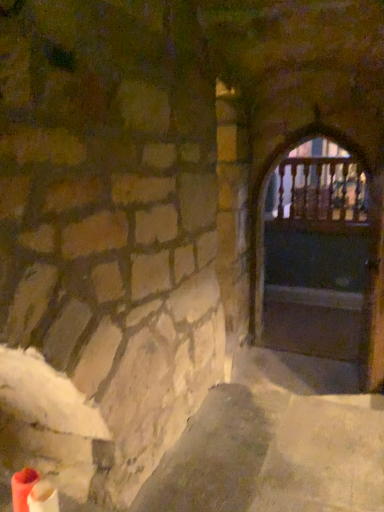
Question: Does point (316, 138) appear closer or farther from the camera than point (263, 297)?

Choices:
 (A) farther
 (B) closer

Answer: (A)

Question: From a real-world perspective, relative to wooden at right, is wooden railing at center vertically above or below?

Choices:
 (A) above
 (B) below

Answer: (A)

Question: Is wooden railing at center taller or shorter than wooden at right?

Choices:
 (A) tall
 (B) short

Answer: (B)

Question: Do you think wooden at right is within wooden railing at center, or outside of it?

Choices:
 (A) outside
 (B) inside

Answer: (A)

Question: Is point (327, 138) positioned closer to the camera than point (332, 212)?

Choices:
 (A) farther
 (B) closer

Answer: (B)

Question: From a real-world perspective, is wooden at right above or below wooden railing at center?

Choices:
 (A) above
 (B) below

Answer: (B)

Question: Considering the positions of wooden at right and wooden railing at center in the image, is wooden at right taller or shorter than wooden railing at center?

Choices:
 (A) tall
 (B) short

Answer: (A)